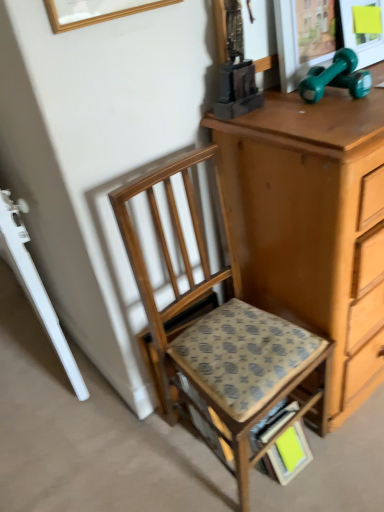
Question: Is wooden picture frame at upper center at the left side of patterned fabric step stool at center?

Choices:
 (A) yes
 (B) no

Answer: (A)

Question: Is wooden picture frame at upper center further to camera compared to patterned fabric step stool at center?

Choices:
 (A) no
 (B) yes

Answer: (A)

Question: From the image's perspective, does wooden picture frame at upper center appear lower than patterned fabric step stool at center?

Choices:
 (A) yes
 (B) no

Answer: (B)

Question: Can you confirm if wooden picture frame at upper center is thinner than patterned fabric step stool at center?

Choices:
 (A) no
 (B) yes

Answer: (B)

Question: Could you tell me if wooden picture frame at upper center is turned towards patterned fabric step stool at center?

Choices:
 (A) yes
 (B) no

Answer: (B)

Question: Considering their positions, is patterned fabric step stool at center located in front of or behind wooden picture frame at upper center?

Choices:
 (A) front
 (B) behind

Answer: (B)

Question: From a real-world perspective, is patterned fabric step stool at center above or below wooden picture frame at upper center?

Choices:
 (A) below
 (B) above

Answer: (A)

Question: Considering the positions of point (271, 333) and point (91, 12), is point (271, 333) closer or farther from the camera than point (91, 12)?

Choices:
 (A) farther
 (B) closer

Answer: (A)

Question: Considering the positions of patterned fabric step stool at center and wooden picture frame at upper center in the image, is patterned fabric step stool at center taller or shorter than wooden picture frame at upper center?

Choices:
 (A) tall
 (B) short

Answer: (A)

Question: Is wooden chair at center in front of or behind wooden picture frame at upper center in the image?

Choices:
 (A) behind
 (B) front

Answer: (A)

Question: From a real-world perspective, is wooden chair at center positioned above or below wooden picture frame at upper center?

Choices:
 (A) above
 (B) below

Answer: (B)

Question: In the image, is wooden chair at center on the left side or the right side of wooden picture frame at upper center?

Choices:
 (A) left
 (B) right

Answer: (B)

Question: Is wooden chair at center situated inside wooden picture frame at upper center or outside?

Choices:
 (A) outside
 (B) inside

Answer: (A)

Question: From their relative heights in the image, would you say wooden picture frame at upper center is taller or shorter than wooden chair at center?

Choices:
 (A) short
 (B) tall

Answer: (A)

Question: Does point (107, 13) appear closer or farther from the camera than point (238, 443)?

Choices:
 (A) farther
 (B) closer

Answer: (B)